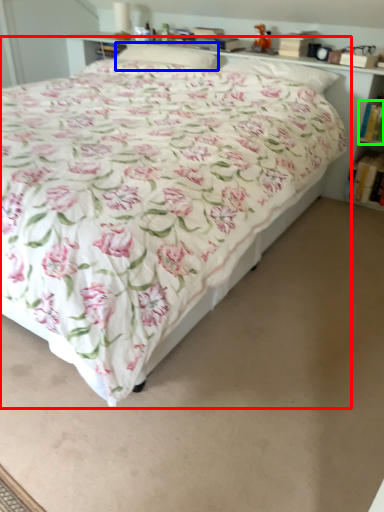
Question: Which object is positioned closest to bed (highlighted by a red box)? Select from pillow (highlighted by a blue box) and book (highlighted by a green box).

Choices:
 (A) pillow
 (B) book

Answer: (A)